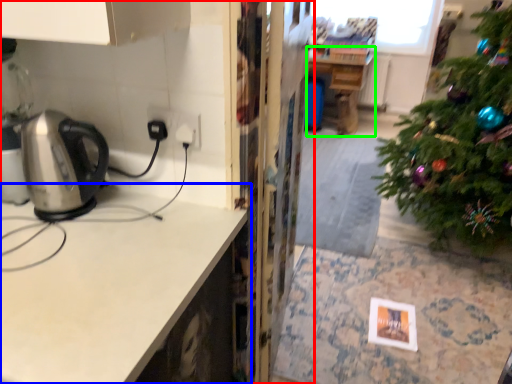
Question: Considering the real-world distances, which object is farthest from cabinetry (highlighted by a red box)? countertop (highlighted by a blue box) or table (highlighted by a green box)?

Choices:
 (A) countertop
 (B) table

Answer: (B)